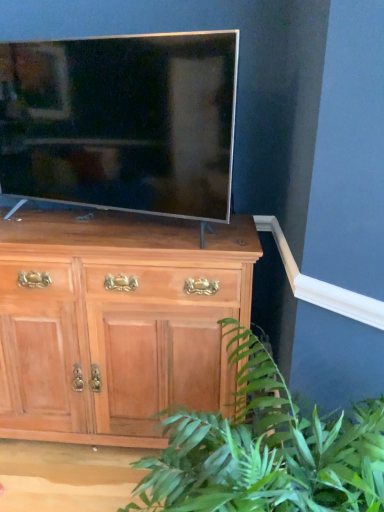
This screenshot has height=512, width=384. Find the location of `vacant region below satin silver tv at center (from a real-world perspective)`. vacant region below satin silver tv at center (from a real-world perspective) is located at coordinates (113, 228).